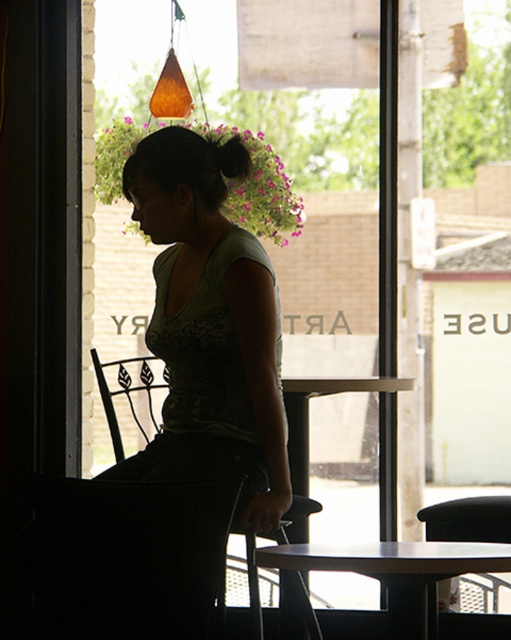
Question: Does smooth white table at center have a greater width compared to metallic black chair at left?

Choices:
 (A) no
 (B) yes

Answer: (B)

Question: Considering the real-world distances, which object is farthest from the black leather chair at lower right?

Choices:
 (A) transparent glass door at center
 (B) smooth white table at center
 (C) metallic black chair at left
 (D) black silky hair at upper center

Answer: (D)

Question: Among these objects, which one is nearest to the camera?

Choices:
 (A) metallic black chair at left
 (B) black silky hair at upper center
 (C) smooth white table at center
 (D) black leather chair at lower right

Answer: (C)

Question: Which point is farther to the camera?

Choices:
 (A) black silky hair at upper center
 (B) black leather chair at lower right

Answer: (B)

Question: Is smooth white table at center smaller than black silky hair at upper center?

Choices:
 (A) no
 (B) yes

Answer: (A)

Question: Can you confirm if transparent glass door at center is positioned below smooth white table at center?

Choices:
 (A) no
 (B) yes

Answer: (A)